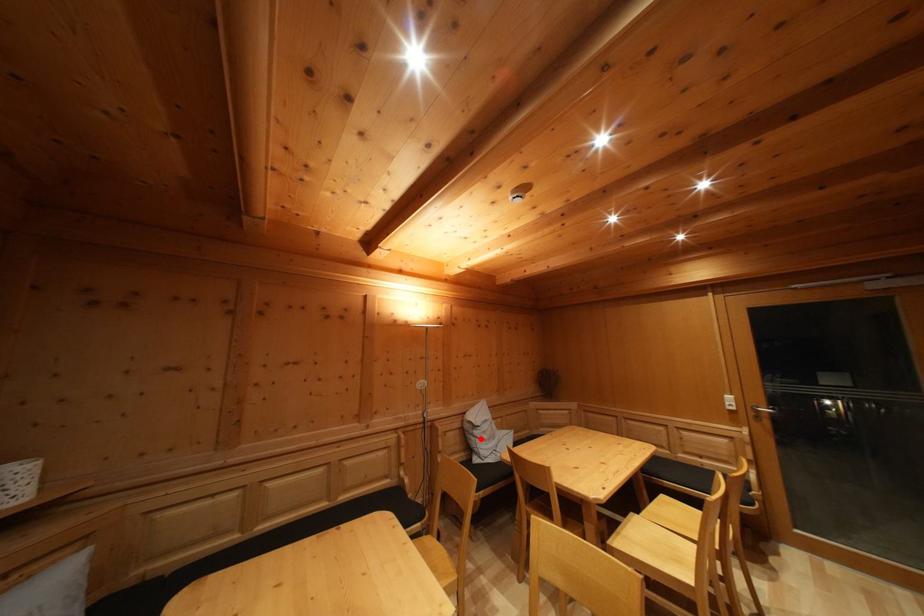
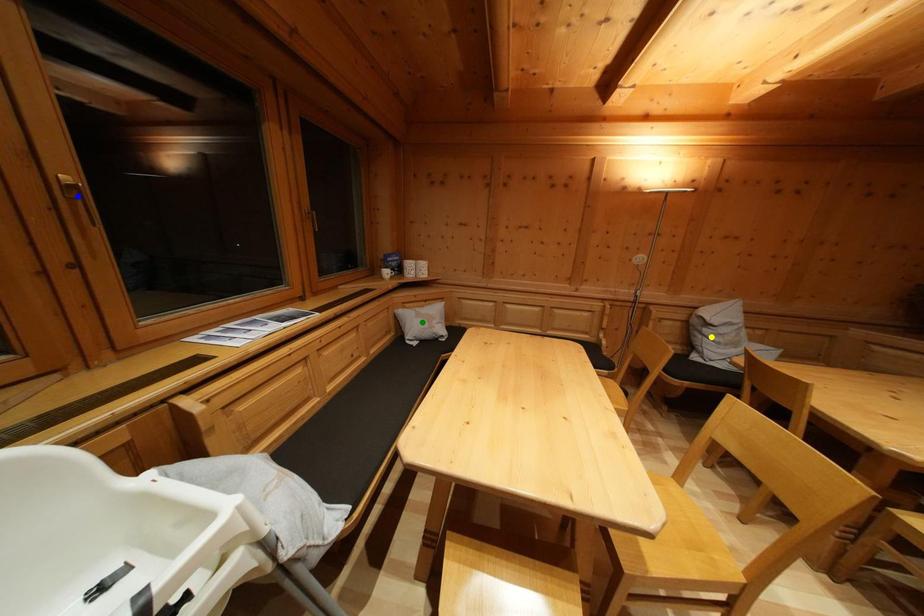
Question: I am providing you with two images of the same scene from different viewpoints. A red point is marked on the first image. You are given multiple points on the second image. Can you choose the point in image 2 that corresponds to the point in image 1?

Choices:
 (A) green point
 (B) blue point
 (C) yellow point

Answer: (C)